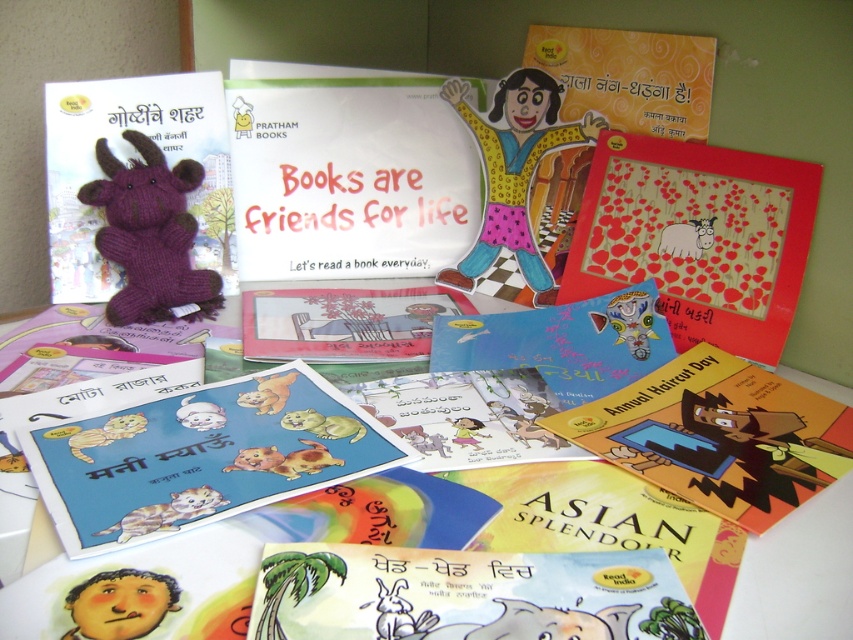
In the scene shown: Between matte yellow paper doll at center and white paper sheep at center, which one appears on the right side from the viewer's perspective?

white paper sheep at center

Does matte yellow paper doll at center come behind white paper sheep at center?

Yes, it is.

Find the location of a particular element. The width and height of the screenshot is (853, 640). matte yellow paper doll at center is located at coordinates (515, 176).

Locate an element on the screen. matte yellow paper doll at center is located at coordinates (515, 176).

Can you confirm if matte red frame at upper right is positioned below fluffy purple stuffed cat at center?

Actually, matte red frame at upper right is above fluffy purple stuffed cat at center.

In the scene shown: Who is higher up, matte red frame at upper right or fluffy purple stuffed cat at center?

matte red frame at upper right is higher up.

Is point (756, 193) behind point (329, 461)?

That is True.

Where is `matte red frame at upper right`? matte red frame at upper right is located at coordinates (703, 250).

Can you confirm if white paper book at center is positioned below matte yellow paper doll at center?

→ Incorrect, white paper book at center is not positioned below matte yellow paper doll at center.

Is the position of white paper book at center more distant than that of matte yellow paper doll at center?

Yes.

What do you see at coordinates (347, 173) in the screenshot? The width and height of the screenshot is (853, 640). I see `white paper book at center` at bounding box center [347, 173].

You are a GUI agent. You are given a task and a screenshot of the screen. Output one action in this format:
    pyautogui.click(x=<x>, y=<y>)
    Task: Click on the white paper book at center
    This screenshot has height=640, width=853.
    Given the screenshot: What is the action you would take?
    pyautogui.click(x=347, y=173)